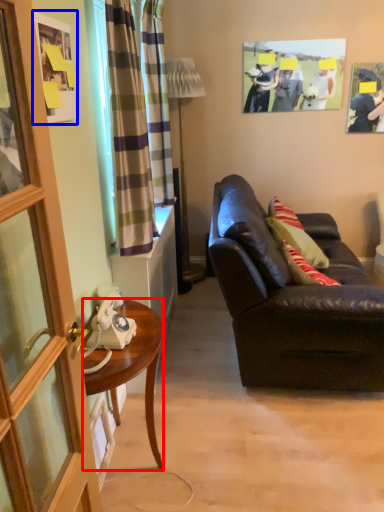
Question: Which object appears farthest to the camera in this image, desk (highlighted by a red box) or picture frame (highlighted by a blue box)?

Choices:
 (A) desk
 (B) picture frame

Answer: (A)